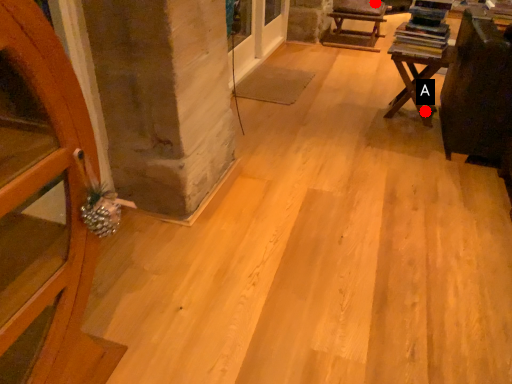
Question: Two points are circled on the image, labeled by A and B beside each circle. Which point appears farthest from the camera in this image?

Choices:
 (A) A is further
 (B) B is further

Answer: (B)